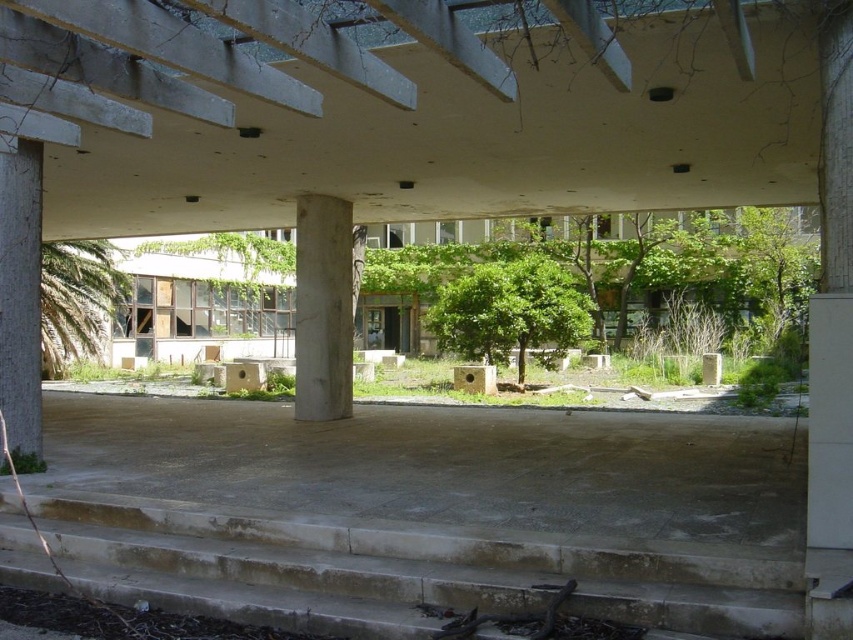
Question: Where is white textured pillar at left located in relation to green leafy tree at left in the image?

Choices:
 (A) right
 (B) left

Answer: (A)

Question: Is white textured pillar at left bigger than green leafy tree at left?

Choices:
 (A) yes
 (B) no

Answer: (B)

Question: Which object appears closest to the camera in this image?

Choices:
 (A) concrete stairs at lower left
 (B) green leafy tree at left

Answer: (A)

Question: Among these objects, which one is farthest from the camera?

Choices:
 (A) green leafy tree at center
 (B) green leafy tree at left

Answer: (A)

Question: From the image, what is the correct spatial relationship of white textured pillar at left in relation to green leafy tree at left?

Choices:
 (A) left
 (B) right

Answer: (B)

Question: Which is nearer to the green leafy tree at center?

Choices:
 (A) white textured pillar at left
 (B) white marble pillar at center
 (C) green leafy tree at left
 (D) concrete stairs at lower left

Answer: (C)